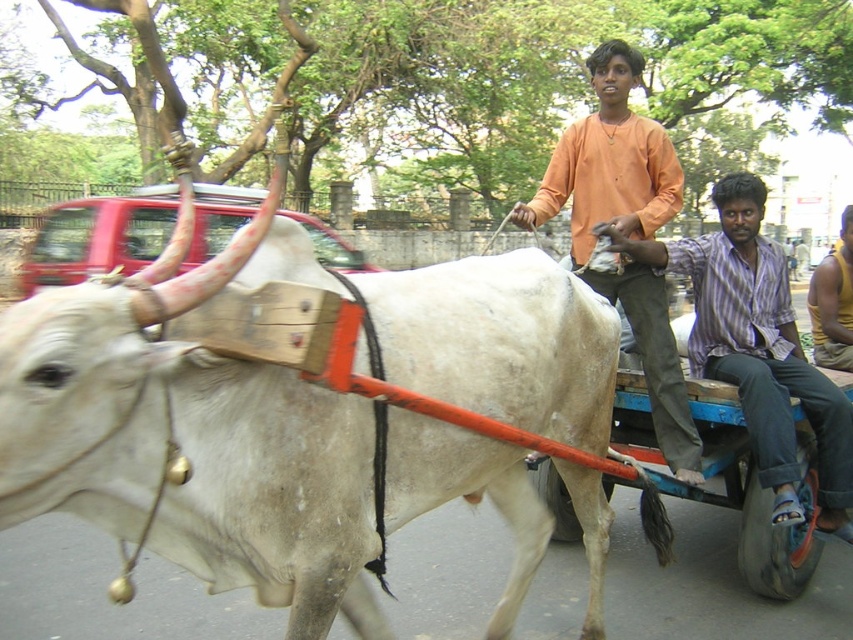
Does striped cotton shirt at right appear over orange cotton shirt at center?

No.

How distant is striped cotton shirt at right from orange cotton shirt at center?

striped cotton shirt at right is 20.66 inches away from orange cotton shirt at center.

Image resolution: width=853 pixels, height=640 pixels. Identify the location of striped cotton shirt at right. (757, 348).

Does point (136, 301) come closer to viewer compared to point (746, 380)?

Yes, it is in front of point (746, 380).

Which is behind, point (59, 509) or point (792, 358)?

Positioned behind is point (792, 358).

The width and height of the screenshot is (853, 640). I want to click on white matte bull at center, so click(x=276, y=408).

This screenshot has height=640, width=853. I want to click on white matte bull at center, so pyautogui.click(x=276, y=408).

Is point (705, 282) in front of point (843, 253)?

That is True.

Which of these two, striped cotton shirt at right or yellow cotton shirt at center, stands shorter?

With less height is yellow cotton shirt at center.

Identify the location of striped cotton shirt at right. (757, 348).